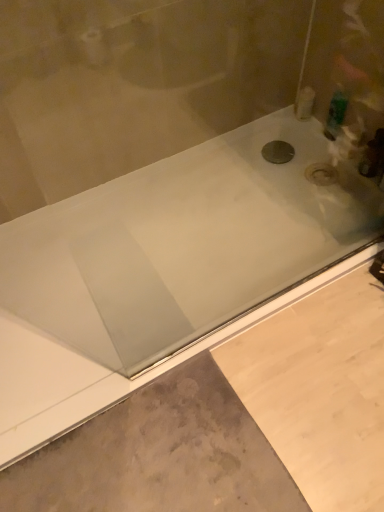
You are a GUI agent. You are given a task and a screenshot of the screen. Output one action in this format:
    pyautogui.click(x=<x>, y=<y>)
    Task: Click on the blank space situated above gray concrete at lower left (from a real-world perspective)
    The width and height of the screenshot is (384, 512).
    Given the screenshot: What is the action you would take?
    pyautogui.click(x=255, y=422)